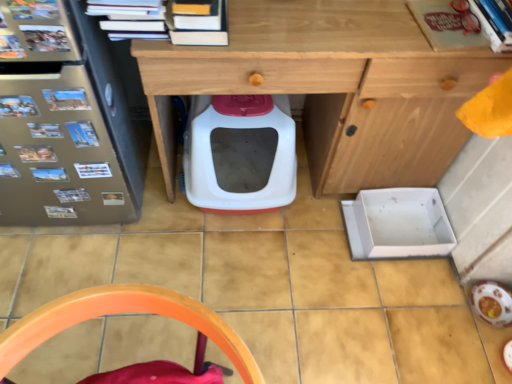
Locate an element on the screen. This screenshot has height=384, width=512. empty space that is in between hardcover books at upper center, the third book when ordered from right to left, and hardcover book at upper right, which is the 3th book from left to right is located at coordinates (327, 28).